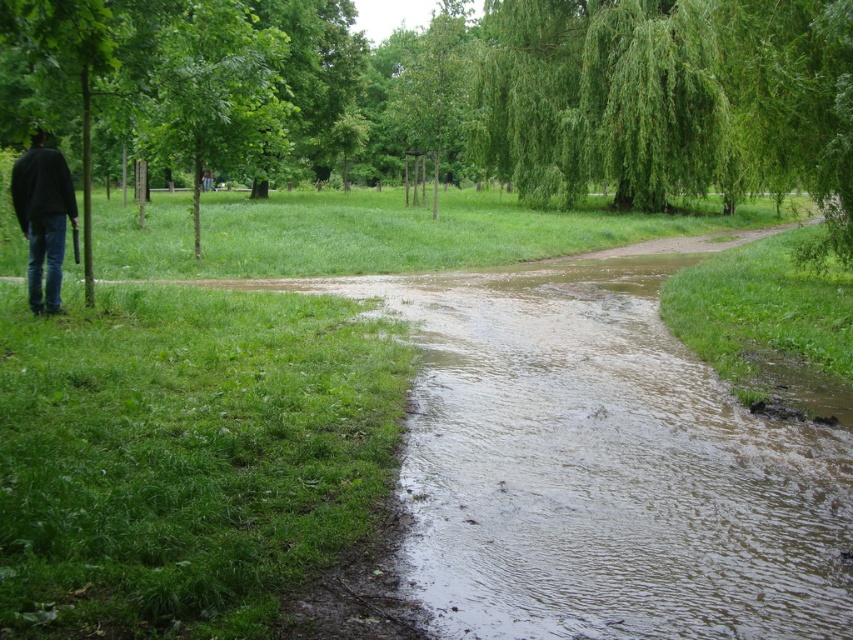
Which is below, green leafy tree at left or black matte jacket at left?

black matte jacket at left is below.

Measure the distance from green leafy tree at left to black matte jacket at left.

green leafy tree at left is 23.92 meters from black matte jacket at left.

Is point (283, 45) more distant than point (32, 157)?

That is True.

Find the location of a particular element. green leafy tree at left is located at coordinates (456, 93).